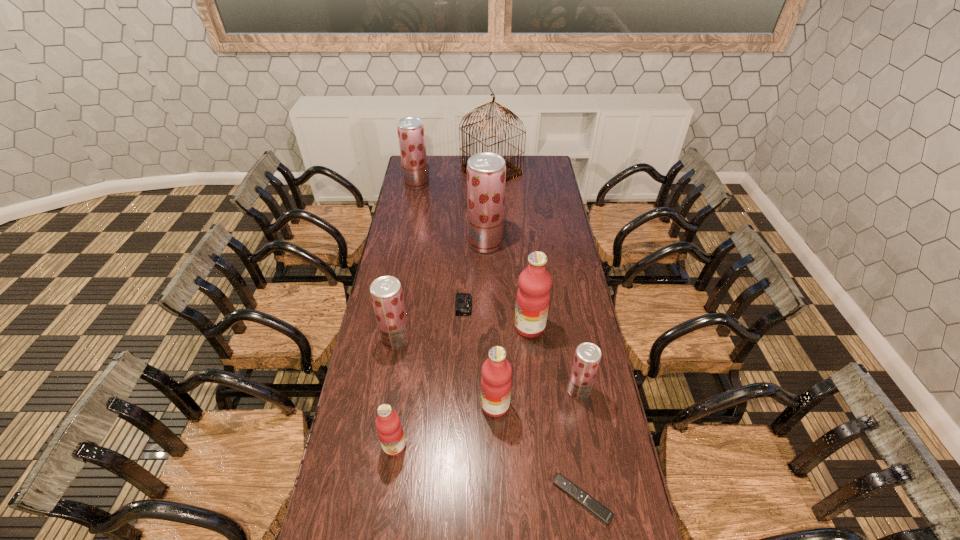
The image size is (960, 540). In order to click on free location located on the left of the shortest object in this screenshot , I will do `click(429, 500)`.

Find the location of a particular element. This screenshot has height=540, width=960. object that is at the far edge is located at coordinates (512, 171).

You are a GUI agent. You are given a task and a screenshot of the screen. Output one action in this format:
    pyautogui.click(x=<x>, y=<y>)
    Task: Click on the fruit juice located at the right edge
    
    Given the screenshot: What is the action you would take?
    pyautogui.click(x=587, y=357)

Identify the location of remote control that is at the right edge. (588, 502).

Identify the location of vacant space at the far edge. click(518, 164).

Where is `vacant space at the left edge of the desktop`? vacant space at the left edge of the desktop is located at coordinates (385, 387).

The width and height of the screenshot is (960, 540). Find the location of `vacant space at the right edge of the desktop`. vacant space at the right edge of the desktop is located at coordinates pos(566,233).

Find the location of a particular element. The image size is (960, 540). empty location between the rightmost strawberry fruit juice and the biggest pink fruit juice is located at coordinates (554, 359).

Locate an element on the screen. free space between the second pink fruit juice from left to right and the ninth tallest object is located at coordinates (480, 355).

Find the location of a particular element. This screenshot has width=960, height=540. free space that is in between the smallest pink fruit juice and the second biggest pink fruit juice is located at coordinates (444, 426).